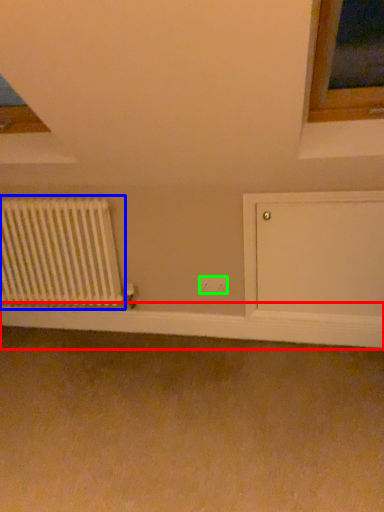
Question: Estimate the real-world distances between objects in this image. Which object is farther from window sill (highlighted by a red box), radiator (highlighted by a blue box) or electric outlet (highlighted by a green box)?

Choices:
 (A) radiator
 (B) electric outlet

Answer: (B)